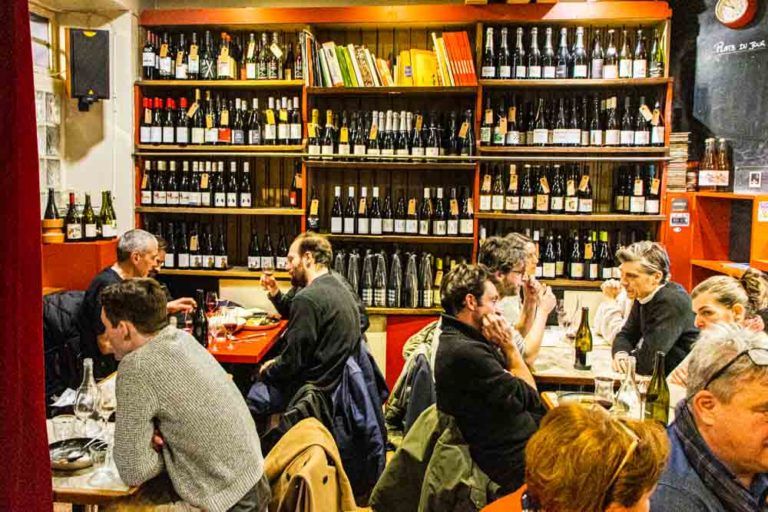
Identify the location of plate. The height and width of the screenshot is (512, 768). (63, 461), (266, 315).